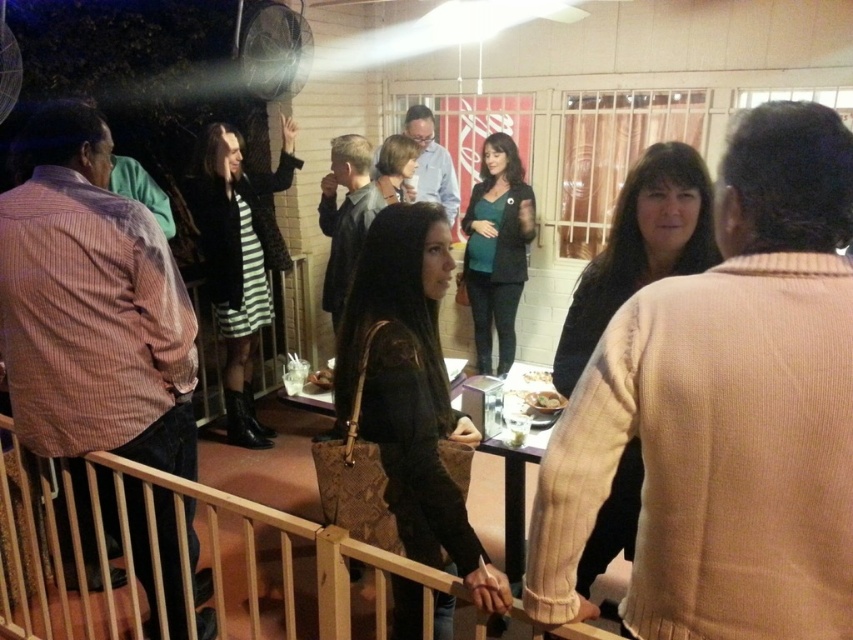
Question: Estimate the real-world distances between objects in this image. Which object is closer to the brown wood rail at center?

Choices:
 (A) smooth brown bowl at center
 (B) matte black blazer at center

Answer: (A)

Question: Considering the relative positions of leather handbag at center and smooth brown bowl at center in the image provided, where is leather handbag at center located with respect to smooth brown bowl at center?

Choices:
 (A) left
 (B) right

Answer: (A)

Question: Which point is farther from the camera taking this photo?

Choices:
 (A) (329, 632)
 (B) (252, 301)

Answer: (B)

Question: Does brown wood rail at center have a lesser width compared to smooth brown bowl at center?

Choices:
 (A) no
 (B) yes

Answer: (A)

Question: Among these objects, which one is farthest from the camera?

Choices:
 (A) shiny plastic bowl at center
 (B) striped fabric dress at center
 (C) leather handbag at center

Answer: (B)

Question: In this image, where is striped fabric dress at center located relative to shiny plastic bowl at center?

Choices:
 (A) right
 (B) left

Answer: (B)